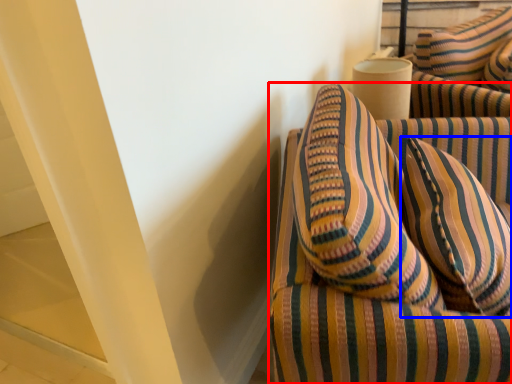
Question: Which point is closer to the camera, furniture (highlighted by a red box) or pillow (highlighted by a blue box)?

Choices:
 (A) furniture
 (B) pillow

Answer: (A)